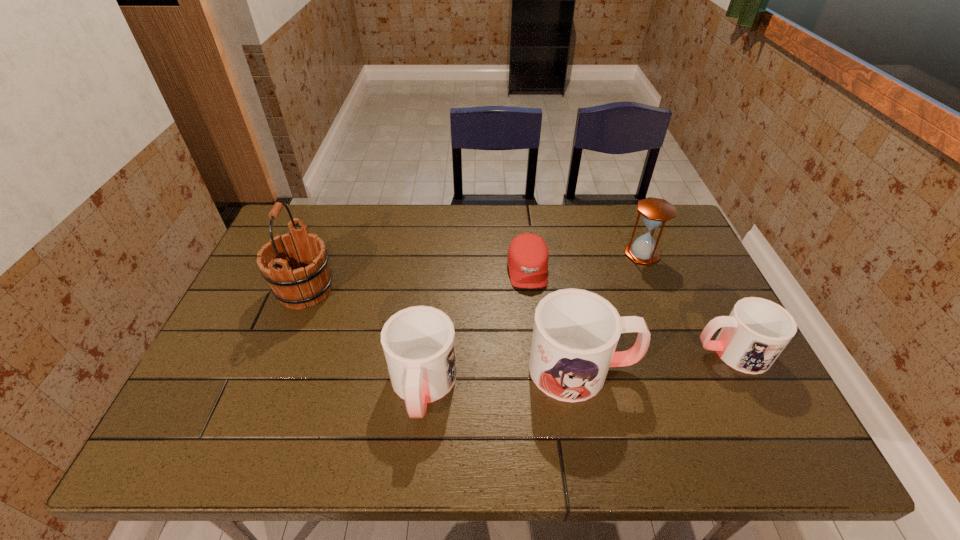
Image resolution: width=960 pixels, height=540 pixels. In order to click on object at the far right corner in this screenshot , I will do `click(655, 212)`.

This screenshot has height=540, width=960. Find the location of `vacant point at the far edge`. vacant point at the far edge is located at coordinates (437, 215).

Identify the location of vacant area at the near edge of the desktop. (645, 383).

In the image, there is a desktop. Where is `free space at the right edge`? This screenshot has height=540, width=960. free space at the right edge is located at coordinates (739, 377).

In the image, there is a desktop. Identify the location of free region at the far right corner. (678, 246).

This screenshot has height=540, width=960. Find the location of `free space at the near right corner of the desktop`. free space at the near right corner of the desktop is located at coordinates (739, 400).

Where is `free space between the second object from left to right and the second mug from left to right`? The image size is (960, 540). free space between the second object from left to right and the second mug from left to right is located at coordinates (502, 377).

You are a GUI agent. You are given a task and a screenshot of the screen. Output one action in this format:
    pyautogui.click(x=<x>, y=<y>)
    Task: Click on the free space between the second shortest mug and the tallest object
    Image resolution: width=960 pixels, height=540 pixels.
    Given the screenshot: What is the action you would take?
    pyautogui.click(x=364, y=338)

Find the location of a particular element. empty space between the shortest mug and the tallest object is located at coordinates (518, 321).

The width and height of the screenshot is (960, 540). I want to click on free space between the shortest object and the second object from left to right, so click(x=475, y=328).